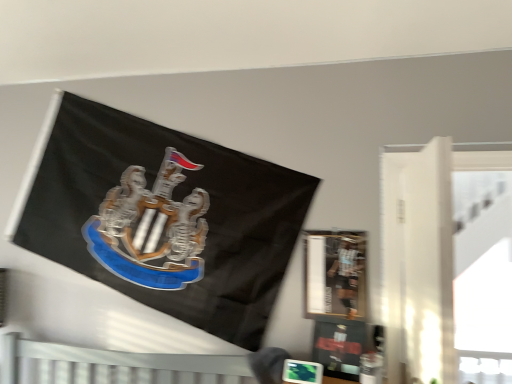
Question: Is metallic silver frame at upper right inside the boundaries of white sheer curtain at right, or outside?

Choices:
 (A) outside
 (B) inside

Answer: (A)

Question: Relative to white sheer curtain at right, is metallic silver frame at upper right in front or behind?

Choices:
 (A) front
 (B) behind

Answer: (B)

Question: Is point (353, 279) positioned closer to the camera than point (386, 304)?

Choices:
 (A) farther
 (B) closer

Answer: (A)

Question: Based on their positions, is white sheer curtain at right located to the left or right of metallic silver frame at upper right?

Choices:
 (A) right
 (B) left

Answer: (A)

Question: Does point (404, 244) appear closer or farther from the camera than point (353, 311)?

Choices:
 (A) closer
 (B) farther

Answer: (A)

Question: From the image's perspective, is white sheer curtain at right positioned above or below metallic silver frame at upper right?

Choices:
 (A) below
 (B) above

Answer: (B)

Question: Would you say white sheer curtain at right is inside or outside metallic silver frame at upper right?

Choices:
 (A) outside
 (B) inside

Answer: (A)